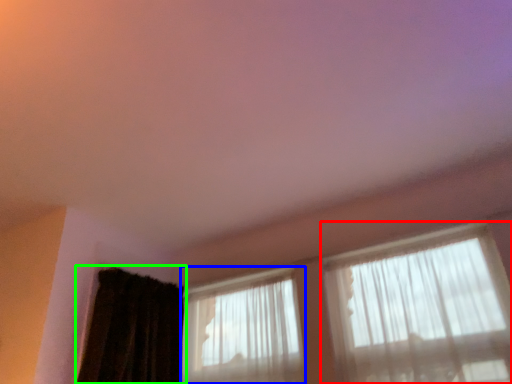
Question: Which object is positioned farthest from window (highlighted by a red box)? Select from window (highlighted by a blue box) and curtain (highlighted by a green box).

Choices:
 (A) window
 (B) curtain

Answer: (B)